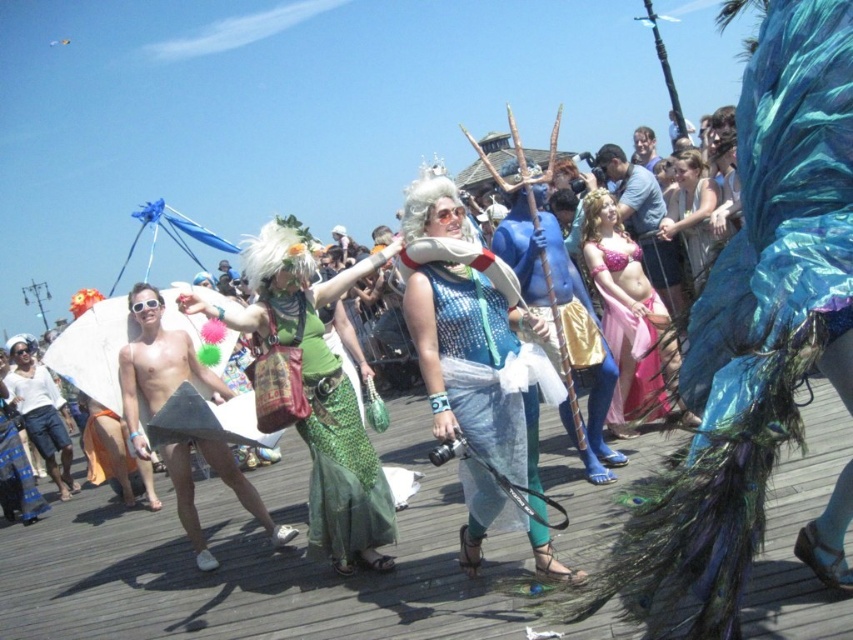
Can you confirm if green sequined dress at center is positioned to the left of green sequined skirt at center?

Incorrect, green sequined dress at center is not on the left side of green sequined skirt at center.

Which is in front, point (263, 316) or point (320, 534)?

Point (320, 534) is in front.

Who is more distant from viewer, (250,328) or (345,436)?

The point (250,328) is more distant.

Where is `green sequined dress at center`? green sequined dress at center is located at coordinates (318, 392).

In the scene shown: Can you confirm if green sequined skirt at center is taller than shiny blue fabric at center?

Correct, green sequined skirt at center is much taller as shiny blue fabric at center.

Where is `green sequined skirt at center`? Image resolution: width=853 pixels, height=640 pixels. green sequined skirt at center is located at coordinates (335, 449).

Between point (369, 467) and point (689, 180), which one is positioned in front?

Point (369, 467) is more forward.

Who is shorter, green sequined dress at center or matte pink fabric dress at center?

With less height is matte pink fabric dress at center.

The image size is (853, 640). I want to click on green sequined dress at center, so click(x=318, y=392).